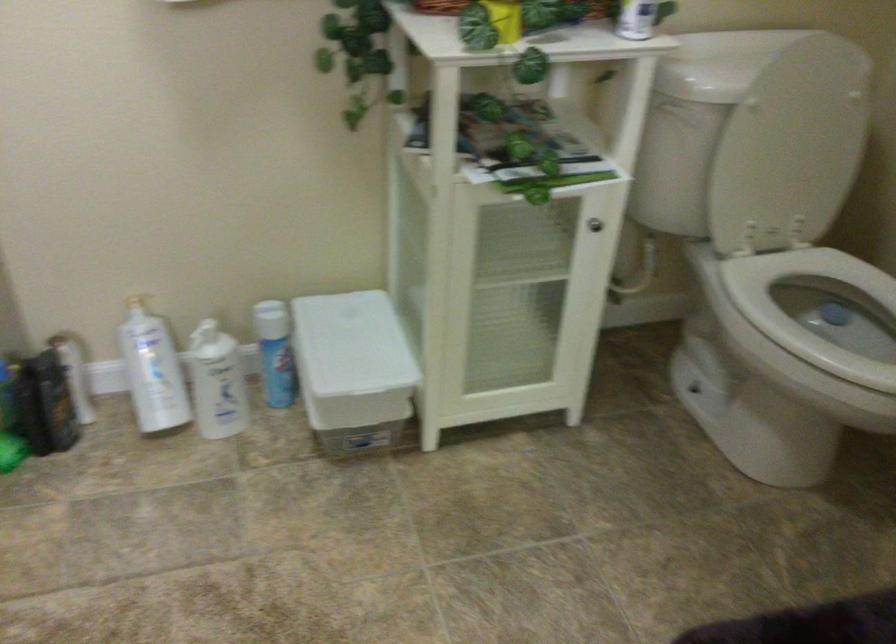
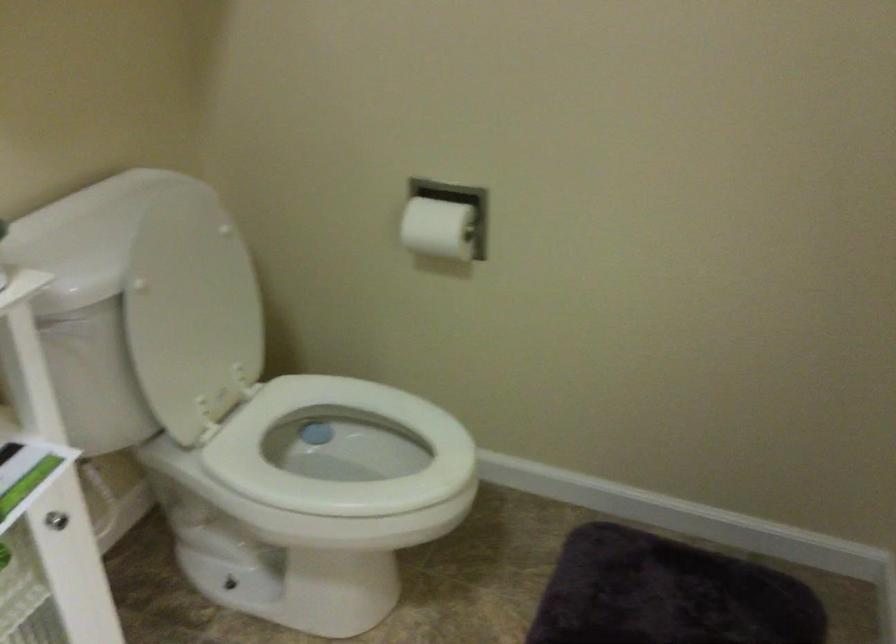
In the second image, find the point that corresponds to (x=773, y=147) in the first image.

(192, 315)